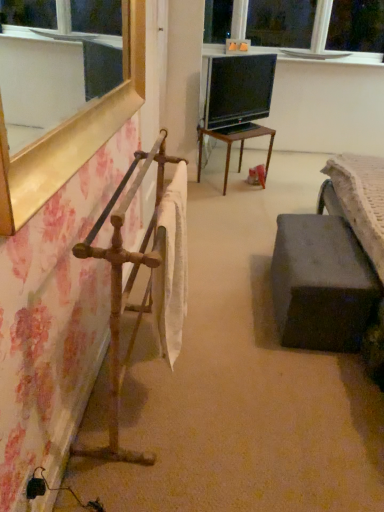
Question: From the image's perspective, relative to wooden table at center, is white glossy window sill at upper center above or below?

Choices:
 (A) below
 (B) above

Answer: (B)

Question: In terms of height, does white glossy window sill at upper center look taller or shorter compared to wooden table at center?

Choices:
 (A) short
 (B) tall

Answer: (A)

Question: Estimate the real-world distances between objects in this image. Which object is closer to the white glossy window sill at upper center?

Choices:
 (A) matte gray ottoman at center
 (B) black glossy tv at center
 (C) rusty metal towel rack at left
 (D) wooden table at center

Answer: (B)

Question: Considering the real-world distances, which object is closest to the black glossy tv at center?

Choices:
 (A) wooden table at center
 (B) white glossy window sill at upper center
 (C) rusty metal towel rack at left
 (D) matte gray ottoman at center

Answer: (A)